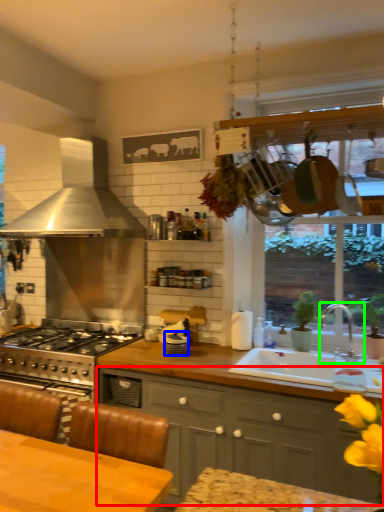
Question: Estimate the real-world distances between objects in this image. Which object is farther from cabinetry (highlighted by a red box), appliance (highlighted by a blue box) or tap (highlighted by a green box)?

Choices:
 (A) appliance
 (B) tap

Answer: (B)